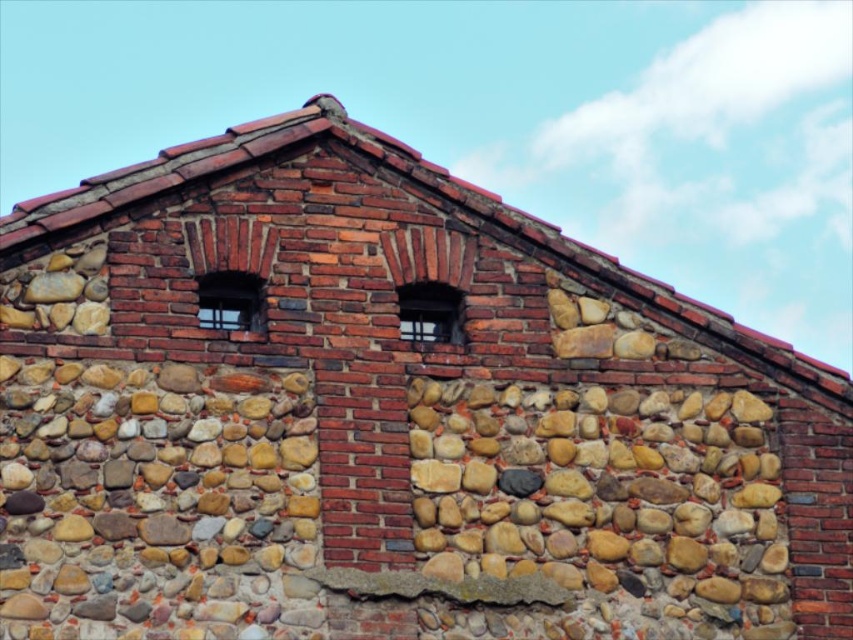
Question: Observing the image, what is the correct spatial positioning of matte glass window at center in reference to clear glass window at upper center?

Choices:
 (A) below
 (B) above

Answer: (A)

Question: Can you confirm if matte glass window at center is wider than clear glass window at upper center?

Choices:
 (A) no
 (B) yes

Answer: (B)

Question: Which point appears closest to the camera in this image?

Choices:
 (A) (431, 300)
 (B) (242, 292)

Answer: (B)

Question: Can you confirm if matte glass window at center is smaller than clear glass window at upper center?

Choices:
 (A) no
 (B) yes

Answer: (A)

Question: Which point is closer to the camera?

Choices:
 (A) clear glass window at upper center
 (B) matte glass window at center

Answer: (A)